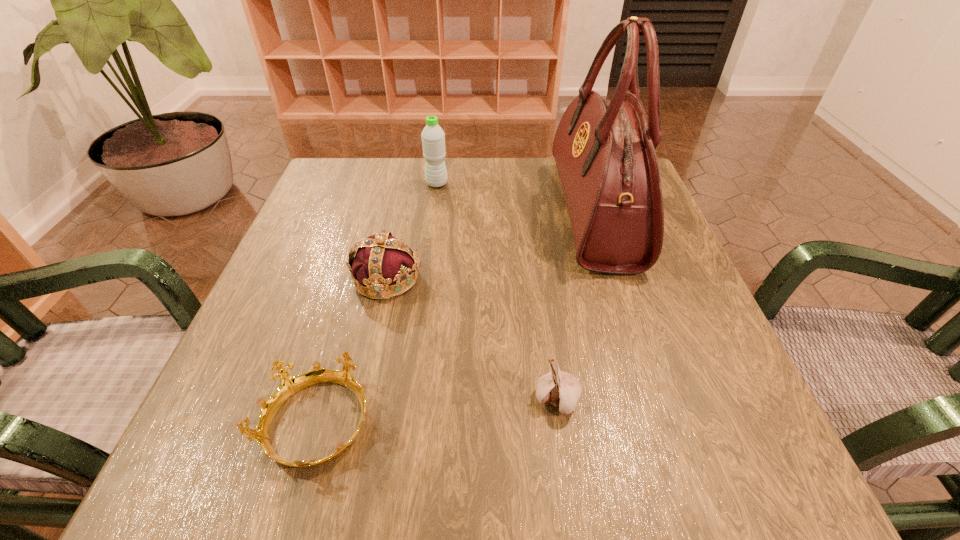
Identify the location of the tallest object. (604, 150).

Locate an element on the screen. handbag is located at coordinates (604, 150).

The width and height of the screenshot is (960, 540). In order to click on the second tallest object in this screenshot , I will do [433, 137].

Identify the location of the taller crown. The image size is (960, 540). (381, 260).

This screenshot has height=540, width=960. In order to click on the third tallest object in this screenshot , I will do `click(381, 260)`.

This screenshot has width=960, height=540. What are the coordinates of `garlic` in the screenshot? It's located at (561, 389).

This screenshot has height=540, width=960. Find the location of `the fourth object from left to right`. the fourth object from left to right is located at coordinates (561, 389).

The height and width of the screenshot is (540, 960). What are the coordinates of `the shorter crown` in the screenshot? It's located at (289, 385).

Where is `the shortest object`? the shortest object is located at coordinates (289, 385).

Where is `vacant space situated on the front-facing side of the tallest object`? vacant space situated on the front-facing side of the tallest object is located at coordinates (441, 212).